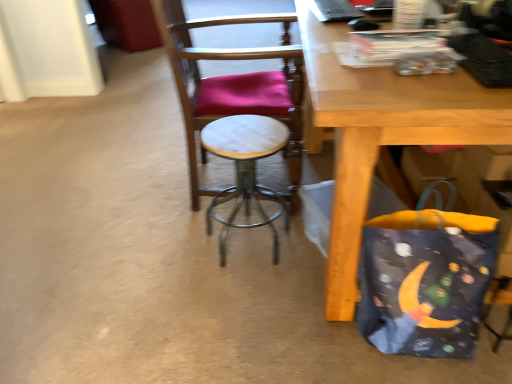
Question: Could you tell me if white marble stool at center is turned towards dark blue fabric bag at lower right?

Choices:
 (A) no
 (B) yes

Answer: (A)

Question: From the image's perspective, is white marble stool at center below dark blue fabric bag at lower right?

Choices:
 (A) no
 (B) yes

Answer: (A)

Question: Is white marble stool at center at the left side of dark blue fabric bag at lower right?

Choices:
 (A) yes
 (B) no

Answer: (A)

Question: Is white marble stool at center positioned behind dark blue fabric bag at lower right?

Choices:
 (A) yes
 (B) no

Answer: (A)

Question: From a real-world perspective, is white marble stool at center physically below dark blue fabric bag at lower right?

Choices:
 (A) no
 (B) yes

Answer: (B)

Question: Does white marble stool at center lie in front of dark blue fabric bag at lower right?

Choices:
 (A) yes
 (B) no

Answer: (B)

Question: Is there a large distance between marble seat at center and dark blue fabric bag at lower right?

Choices:
 (A) yes
 (B) no

Answer: (B)

Question: Is marble seat at center at the left side of dark blue fabric bag at lower right?

Choices:
 (A) yes
 (B) no

Answer: (A)

Question: Does marble seat at center appear on the right side of dark blue fabric bag at lower right?

Choices:
 (A) no
 (B) yes

Answer: (A)

Question: Is marble seat at center in front of dark blue fabric bag at lower right?

Choices:
 (A) yes
 (B) no

Answer: (B)

Question: Is marble seat at center facing towards dark blue fabric bag at lower right?

Choices:
 (A) yes
 (B) no

Answer: (B)

Question: Is marble seat at center directly adjacent to dark blue fabric bag at lower right?

Choices:
 (A) no
 (B) yes

Answer: (A)

Question: Is dark blue fabric bag at lower right to the right of marble seat at center from the viewer's perspective?

Choices:
 (A) no
 (B) yes

Answer: (B)